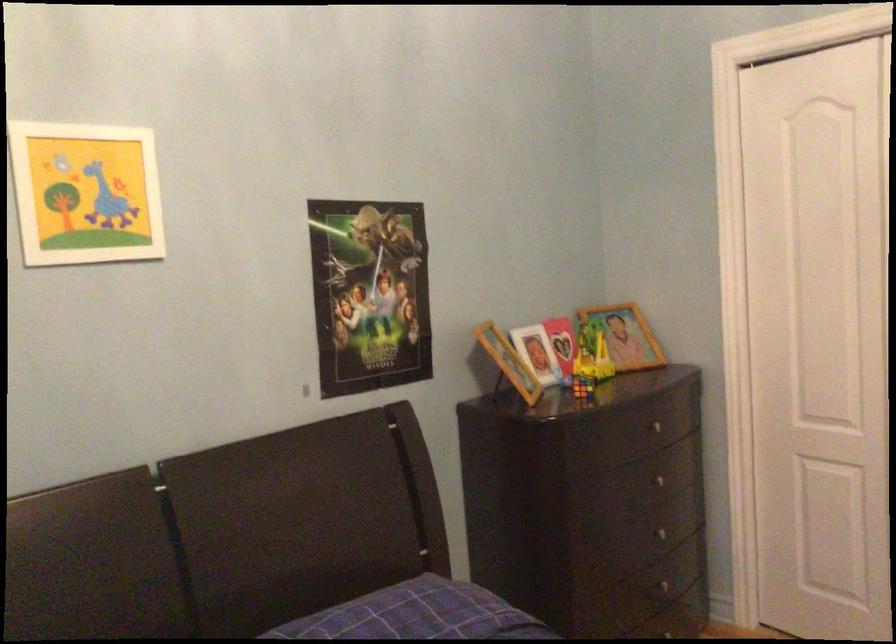
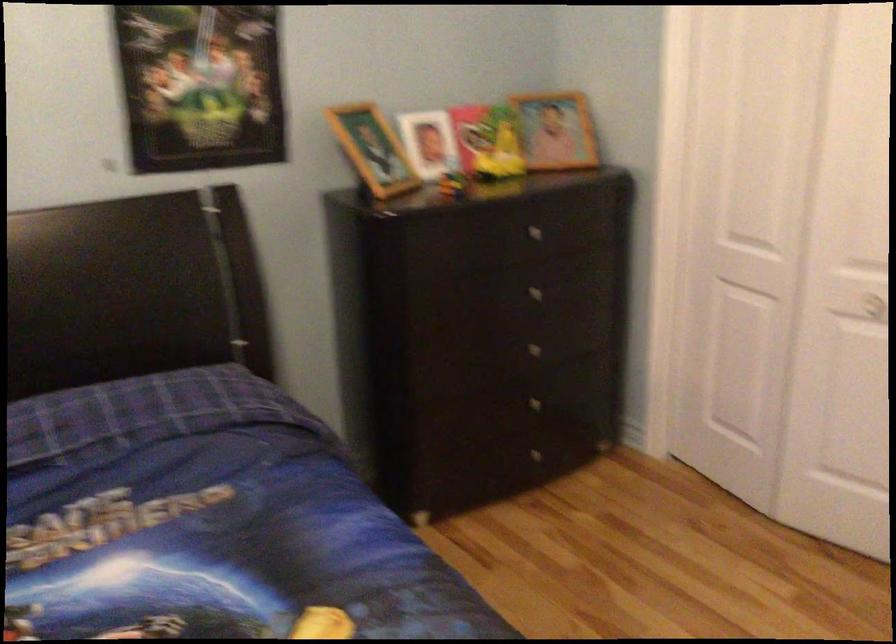
The point at (x=633, y=339) is marked in the first image. Where is the corresponding point in the second image?

(556, 129)